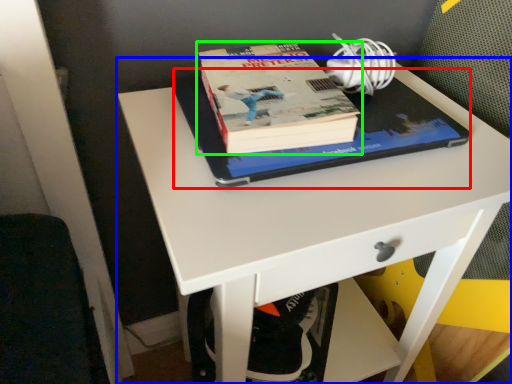
Question: Based on their relative distances, which object is nearer to notebook (highlighted by a red box)? Choose from desk (highlighted by a blue box) and book (highlighted by a green box).

Choices:
 (A) desk
 (B) book

Answer: (B)